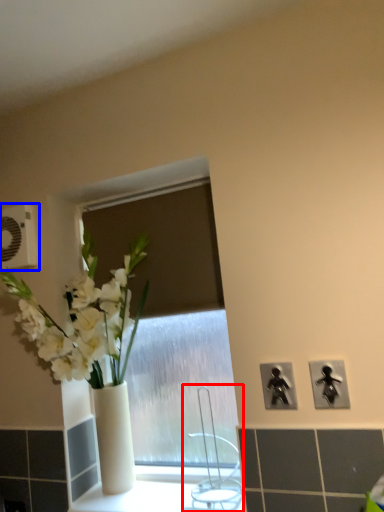
Question: Which point is closer to the camera, faucet (highlighted by a red box) or electric outlet (highlighted by a blue box)?

Choices:
 (A) faucet
 (B) electric outlet

Answer: (A)